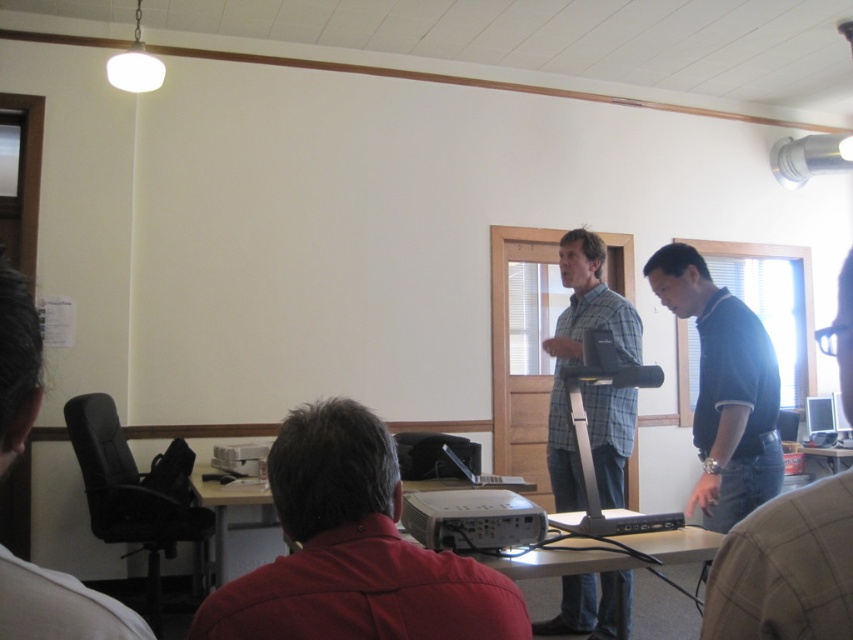
Question: Considering the real-world distances, which object is farthest from the black leather chair at left?

Choices:
 (A) blue polo shirt at right
 (B) red matte projector at lower center
 (C) plaid cotton shirt at center
 (D) white plastic projector at center

Answer: (C)

Question: Which of the following is the closest to the observer?

Choices:
 (A) silver metallic monitor at center
 (B) black leather chair at left
 (C) blue smooth shirt at right
 (D) white plastic projector at center

Answer: (B)

Question: In this image, where is plaid cotton shirt at center located relative to black leather chair at left?

Choices:
 (A) left
 (B) right

Answer: (B)

Question: Is black leather chair at left positioned behind white plastic projector at center?

Choices:
 (A) no
 (B) yes

Answer: (A)

Question: Which is nearer to the blue polo shirt at right?

Choices:
 (A) plaid cotton shirt at center
 (B) blue smooth shirt at right

Answer: (B)

Question: Is blue polo shirt at right positioned behind silver metallic monitor at center?

Choices:
 (A) yes
 (B) no

Answer: (B)